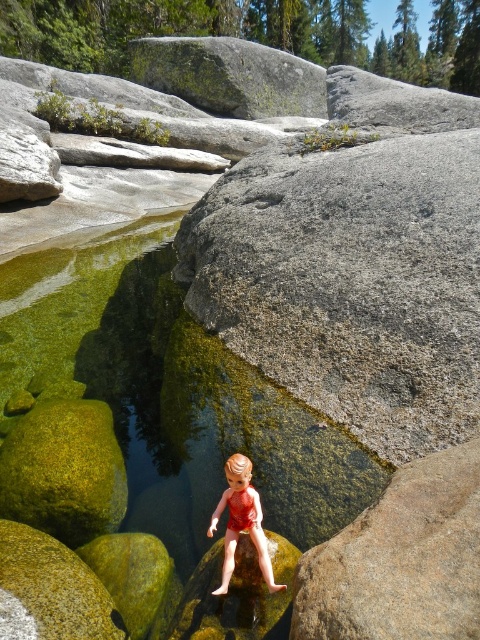
Question: Which point is farther from the camera taking this photo?

Choices:
 (A) (240, 486)
 (B) (84, 481)

Answer: (B)

Question: Is green mossy water at center thinner than green mossy rock at lower left?

Choices:
 (A) no
 (B) yes

Answer: (B)

Question: Considering the relative positions of green mossy rock at lower left and matte orange swimsuit at center in the image provided, where is green mossy rock at lower left located with respect to matte orange swimsuit at center?

Choices:
 (A) above
 (B) below

Answer: (B)

Question: Which point is closer to the camera?

Choices:
 (A) (360, 584)
 (B) (259, 513)

Answer: (A)

Question: Does green mossy rock at upper center have a smaller size compared to matte orange swimsuit at center?

Choices:
 (A) no
 (B) yes

Answer: (A)

Question: Based on their relative distances, which object is farther from the green mossy water at center?

Choices:
 (A) matte orange swimsuit at center
 (B) gray granite boulder at center
 (C) green mossy rock at upper center
 (D) green mossy rock at lower left

Answer: (C)